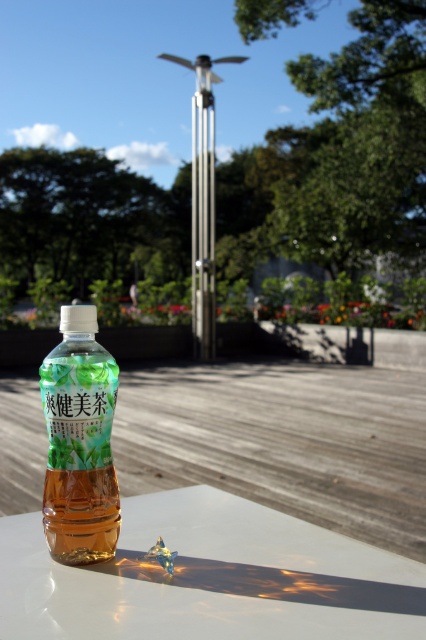
Question: Which object is farther from the camera taking this photo?

Choices:
 (A) white glossy table at lower center
 (B) translucent plastic bottle at center

Answer: (B)

Question: Does white glossy table at lower center appear on the right side of translucent plastic bottle at center?

Choices:
 (A) no
 (B) yes

Answer: (B)

Question: Does white glossy table at lower center appear over translucent plastic bottle at center?

Choices:
 (A) no
 (B) yes

Answer: (A)

Question: Does white glossy table at lower center appear on the right side of translucent plastic bottle at center?

Choices:
 (A) yes
 (B) no

Answer: (A)

Question: Which object appears farthest from the camera in this image?

Choices:
 (A) translucent plastic bottle at center
 (B) white glossy table at lower center

Answer: (A)

Question: Which of the following is the farthest from the observer?

Choices:
 (A) white glossy table at lower center
 (B) translucent plastic bottle at center

Answer: (B)